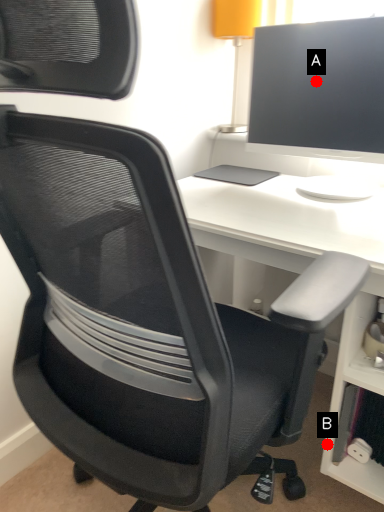
Question: Two points are circled on the image, labeled by A and B beside each circle. Which point appears farthest from the camera in this image?

Choices:
 (A) A is further
 (B) B is further

Answer: (A)